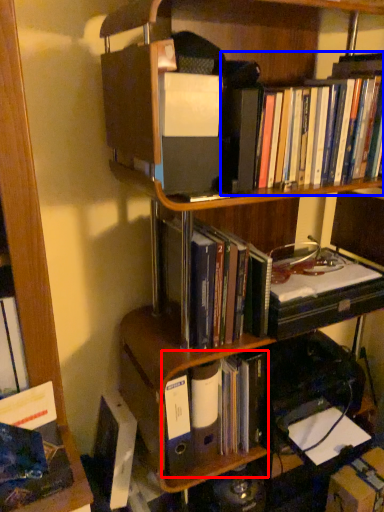
Question: Among these objects, which one is farthest to the camera, book (highlighted by a red box) or book (highlighted by a blue box)?

Choices:
 (A) book
 (B) book

Answer: (A)